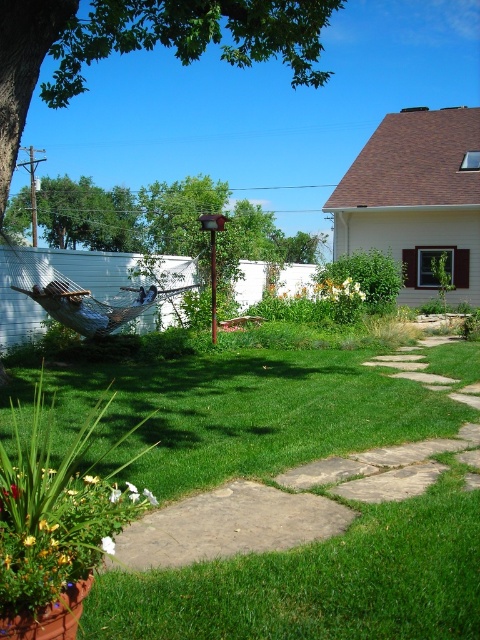
Question: Is green leafy tree at upper left smaller than blue fabric hammock at center?

Choices:
 (A) no
 (B) yes

Answer: (A)

Question: Is green leafy tree at upper left bigger than blue fabric hammock at center?

Choices:
 (A) yes
 (B) no

Answer: (A)

Question: Which object is farther from the camera taking this photo?

Choices:
 (A) blue fabric hammock at center
 (B) green leafy tree at upper left

Answer: (A)

Question: Considering the relative positions of green leafy tree at upper left and blue fabric hammock at center in the image provided, where is green leafy tree at upper left located with respect to blue fabric hammock at center?

Choices:
 (A) above
 (B) below

Answer: (A)

Question: Which of the following is the closest to the observer?

Choices:
 (A) blue fabric hammock at center
 (B) green leafy tree at upper left

Answer: (B)

Question: Which point is closer to the camera taking this photo?

Choices:
 (A) (108, 310)
 (B) (74, 17)

Answer: (B)